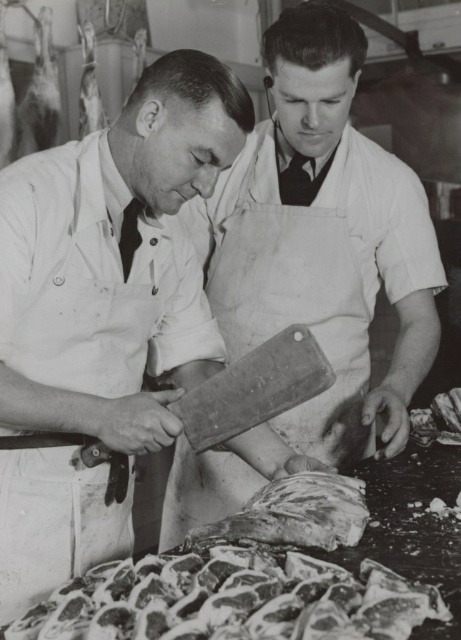
You are a butcher who needs to place a 50 cm long meat slab on the table. The smooth wooden cutting board at center and the rough textured meat at center are already on the table. Can you fit the meat slab between them without moving either object?

The distance between the smooth wooden cutting board at center and the rough textured meat at center is 49.84 centimeters, which is slightly less than the 50 cm length of the meat slab. Therefore, the slab cannot be placed between them without moving at least one of the objects.

Based on the scene described, which object is shorter between the rusty metal meat at lower center and the rough textured meat at center?

The rusty metal meat at lower center is shorter than the rough textured meat at center.

You are a customer in the butcher shop and want to know where the smooth white apron at center is in relation to the rough textured meat at center. Can you tell me if the apron is above or below the meat?

The smooth white apron at center is located above the rough textured meat at center.